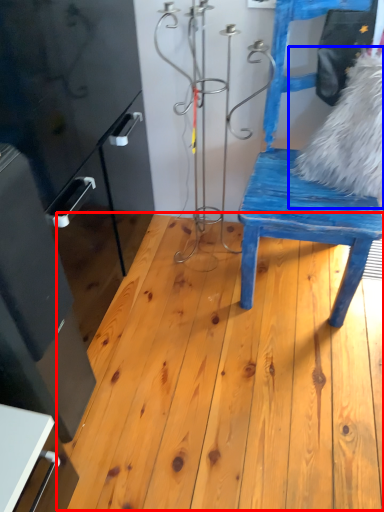
Question: Which point is further to the camera, hardwood (highlighted by a red box) or animal (highlighted by a blue box)?

Choices:
 (A) hardwood
 (B) animal

Answer: (B)